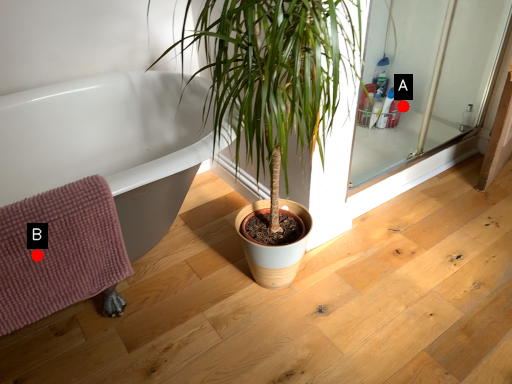
Question: Two points are circled on the image, labeled by A and B beside each circle. Which point appears farthest from the camera in this image?

Choices:
 (A) A is further
 (B) B is further

Answer: (A)